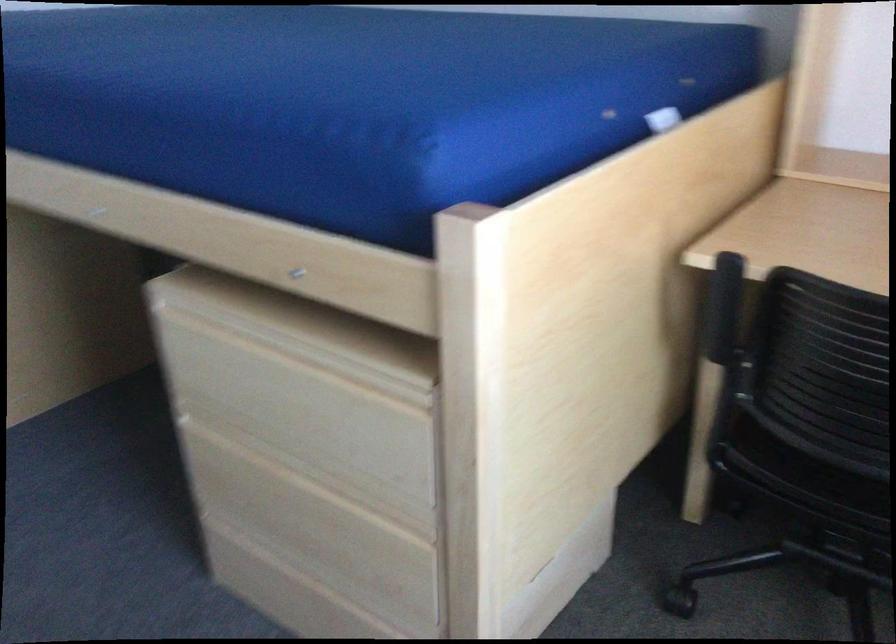
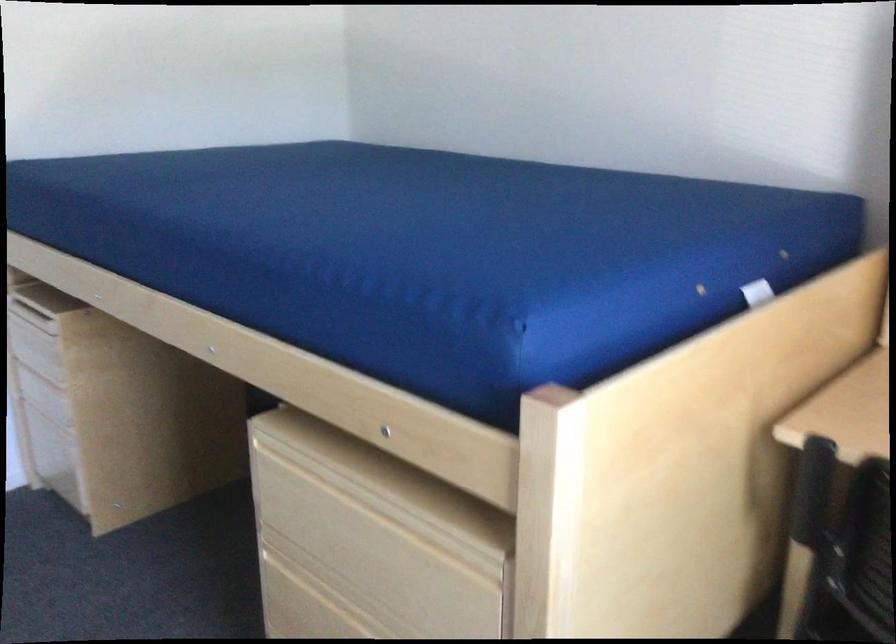
Question: Based on the continuous images, in which direction is the camera rotating? Reply with the corresponding letter.

Choices:
 (A) Left
 (B) Right
 (C) Up
 (D) Down

Answer: (C)